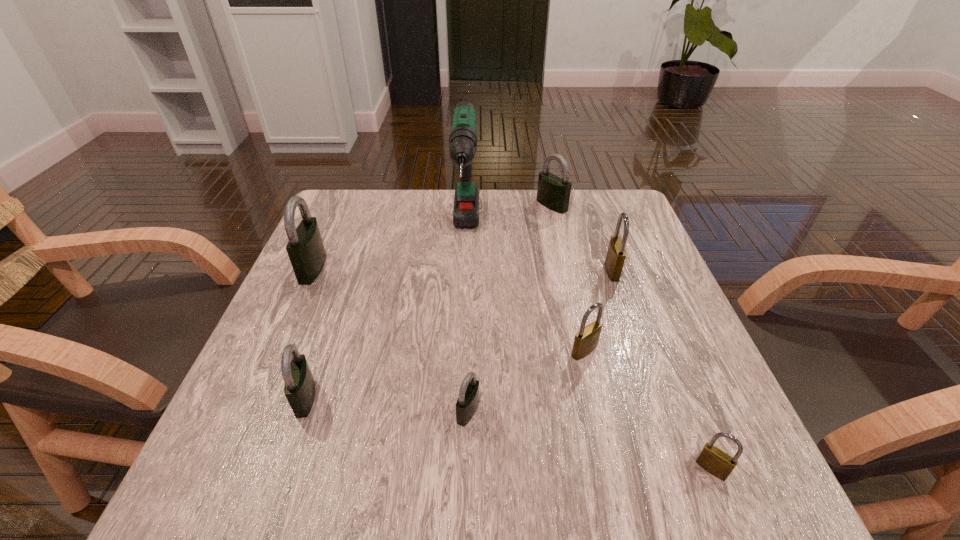
You are a GUI agent. You are given a task and a screenshot of the screen. Output one action in this format:
    pyautogui.click(x=<x>, y=<y>)
    Task: Click on the tallest object
    
    Given the screenshot: What is the action you would take?
    pyautogui.click(x=463, y=140)

Image resolution: width=960 pixels, height=540 pixels. I want to click on green drill, so click(x=463, y=140).

You are a GUI agent. You are given a task and a screenshot of the screen. Output one action in this format:
    pyautogui.click(x=<x>, y=<y>)
    Task: Click on the leftmost object
    The width and height of the screenshot is (960, 540).
    Given the screenshot: What is the action you would take?
    [x=305, y=248]

Identify the location of the second farthest black padlock. (305, 248).

This screenshot has width=960, height=540. I want to click on the rightmost black padlock, so click(x=553, y=192).

This screenshot has width=960, height=540. In order to click on the farthest padlock in this screenshot , I will do `click(553, 192)`.

The width and height of the screenshot is (960, 540). I want to click on the second object from right to left, so click(616, 254).

Identify the location of the farthest brass padlock. The width and height of the screenshot is (960, 540). (616, 254).

Find the location of `the second padlock from left to right`. the second padlock from left to right is located at coordinates (299, 389).

At what (x,y) coordinates should I click in order to perform the action: click on the second black padlock from left to right. Please return your answer as a coordinate pair (x, y). This screenshot has height=540, width=960. Looking at the image, I should click on (299, 389).